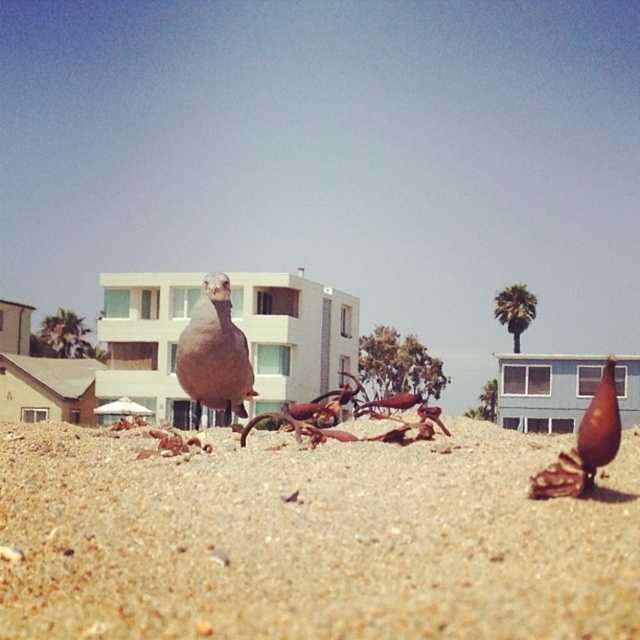
Which is behind, point (225, 392) or point (596, 394)?

Point (596, 394)

Does point (204, 308) lie behind point (563, 458)?

That is True.

The width and height of the screenshot is (640, 640). I want to click on brown matte bird at center, so click(x=214, y=355).

Consider the image. Does brown sandy beach at center appear on the right side of brown matte bird at center?

Correct, you'll find brown sandy beach at center to the right of brown matte bird at center.

Is point (76, 516) more distant than point (252, 374)?

No, it is not.

Does point (410, 499) lie in front of point (193, 397)?

Yes, point (410, 499) is in front of point (193, 397).

Where is `brown sandy beach at center`? The height and width of the screenshot is (640, 640). brown sandy beach at center is located at coordinates (310, 540).

Which is in front, point (428, 465) or point (586, 451)?

Point (586, 451)

In order to click on brown sandy beach at center in this screenshot , I will do `click(310, 540)`.